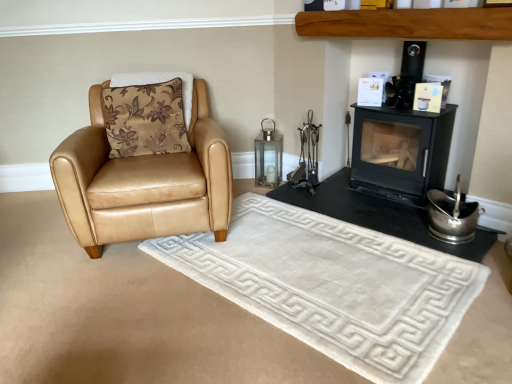
Question: Considering the relative positions of black matte fireplace at right and tan leather armchair at left in the image provided, is black matte fireplace at right in front of tan leather armchair at left?

Choices:
 (A) no
 (B) yes

Answer: (A)

Question: Considering the relative sizes of black matte fireplace at right and tan leather armchair at left in the image provided, is black matte fireplace at right smaller than tan leather armchair at left?

Choices:
 (A) no
 (B) yes

Answer: (B)

Question: From the image's perspective, is black matte fireplace at right located beneath tan leather armchair at left?

Choices:
 (A) no
 (B) yes

Answer: (B)

Question: From a real-world perspective, is black matte fireplace at right beneath tan leather armchair at left?

Choices:
 (A) no
 (B) yes

Answer: (B)

Question: Does black matte fireplace at right appear on the right side of tan leather armchair at left?

Choices:
 (A) no
 (B) yes

Answer: (B)

Question: In terms of width, does tan leather armchair at left look wider or thinner when compared to black matte fireplace at right?

Choices:
 (A) wide
 (B) thin

Answer: (A)

Question: Is tan leather armchair at left situated inside black matte fireplace at right or outside?

Choices:
 (A) inside
 (B) outside

Answer: (B)

Question: Based on their sizes in the image, would you say tan leather armchair at left is bigger or smaller than black matte fireplace at right?

Choices:
 (A) small
 (B) big

Answer: (B)

Question: From a real-world perspective, is tan leather armchair at left positioned above or below black matte fireplace at right?

Choices:
 (A) above
 (B) below

Answer: (A)

Question: Is brown floral fabric pillow at left taller or shorter than tan leather armchair at left?

Choices:
 (A) short
 (B) tall

Answer: (A)

Question: Looking at their shapes, would you say brown floral fabric pillow at left is wider or thinner than tan leather armchair at left?

Choices:
 (A) thin
 (B) wide

Answer: (A)

Question: Is brown floral fabric pillow at left in front of or behind tan leather armchair at left in the image?

Choices:
 (A) behind
 (B) front

Answer: (A)

Question: From the image's perspective, is brown floral fabric pillow at left above or below tan leather armchair at left?

Choices:
 (A) above
 (B) below

Answer: (A)

Question: Is black matte wood burning stove at upper right bigger or smaller than brown floral fabric pillow at left?

Choices:
 (A) small
 (B) big

Answer: (B)

Question: From the image's perspective, is black matte wood burning stove at upper right above or below brown floral fabric pillow at left?

Choices:
 (A) above
 (B) below

Answer: (B)